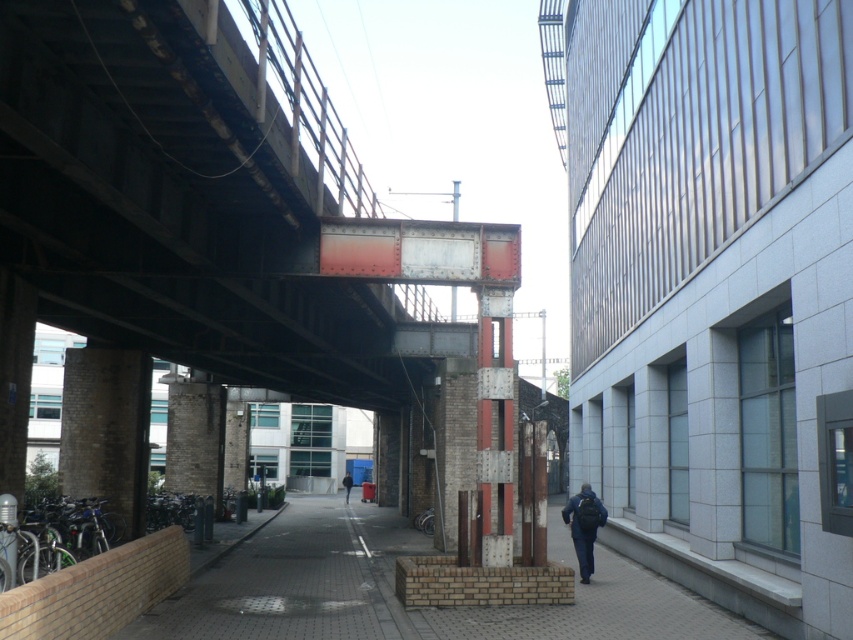
You are standing on the smooth concrete pavement at center and want to move to the dark blue jeans at center. In which direction should you walk to reach them?

The smooth concrete pavement at center is positioned on the left side of dark blue jeans at center, so you should walk to the right to reach them.

You are a delivery robot navigating an urban area. You see the smooth concrete pavement at center and the dark blue jeans at center. Which surface should you avoid stepping on to ensure safe passage?

The dark blue jeans at center should be avoided as the smooth concrete pavement at center is located below it, indicating the jeans are on top of the pavement.

You are standing on the pedestrian walkway in the urban scene and notice both the smooth concrete pavement at center and the dark blue jeans at center. Which object is nearer to you?

The smooth concrete pavement at center is closer to the viewer than the dark blue jeans at center.